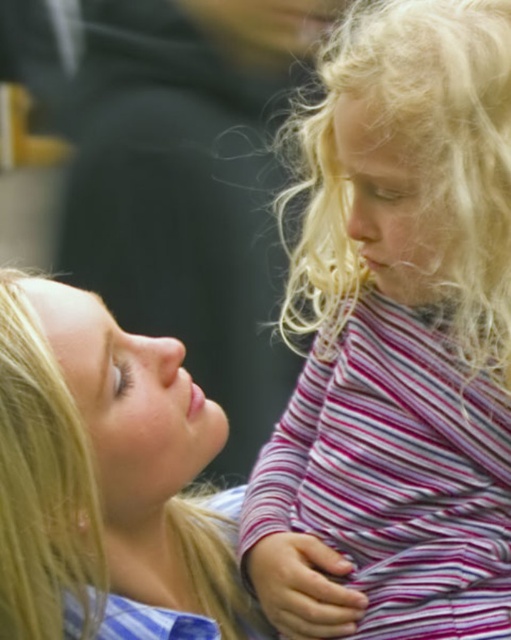
Question: Which point is farther to the camera?

Choices:
 (A) blonde hair at upper left
 (B) striped fabric dress at right

Answer: (B)

Question: Is striped fabric dress at right to the right of blonde hair at upper left from the viewer's perspective?

Choices:
 (A) no
 (B) yes

Answer: (B)

Question: Does striped fabric dress at right appear over blonde hair at upper left?

Choices:
 (A) no
 (B) yes

Answer: (B)

Question: Which point is closer to the camera?

Choices:
 (A) (389, 253)
 (B) (193, 550)

Answer: (A)

Question: Which object appears farthest from the camera in this image?

Choices:
 (A) blonde hair at upper left
 (B) striped fabric dress at right

Answer: (B)

Question: Can you confirm if striped fabric dress at right is positioned to the right of blonde hair at upper left?

Choices:
 (A) no
 (B) yes

Answer: (B)